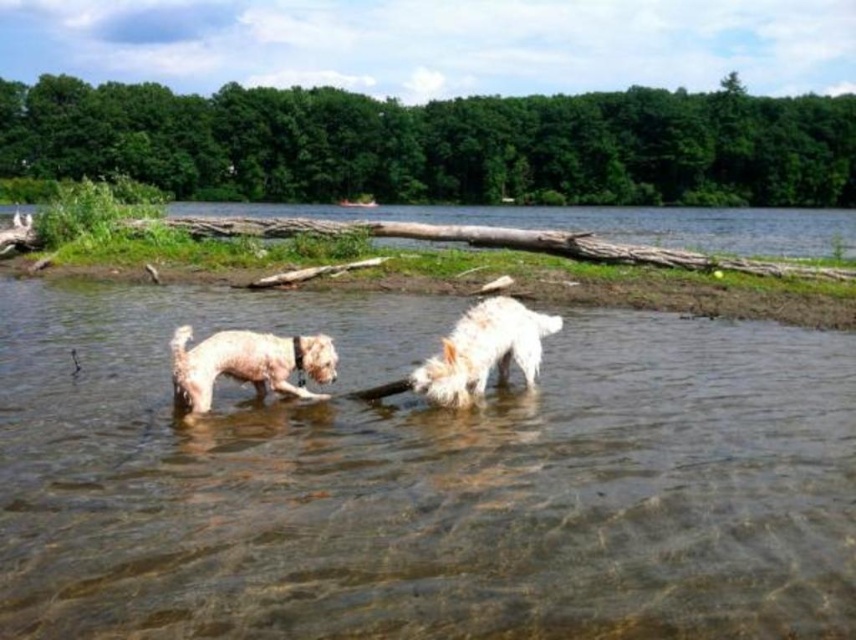
Question: Which of the following is the farthest from the observer?

Choices:
 (A) clear water at center
 (B) white fluffy dog at center
 (C) white fluffy dog at lower left
 (D) brown rough log at upper center

Answer: (D)

Question: Where is clear water at center located in relation to white fluffy dog at center in the image?

Choices:
 (A) left
 (B) right

Answer: (A)

Question: Is clear water at center further to camera compared to brown rough log at upper center?

Choices:
 (A) yes
 (B) no

Answer: (B)

Question: Which of the following is the closest to the observer?

Choices:
 (A) (456, 326)
 (B) (768, 232)

Answer: (A)

Question: Can you confirm if brown rough log at upper center is thinner than white fluffy dog at center?

Choices:
 (A) no
 (B) yes

Answer: (A)

Question: Which of the following is the farthest from the observer?

Choices:
 (A) (389, 636)
 (B) (491, 353)
 (C) (250, 358)

Answer: (B)